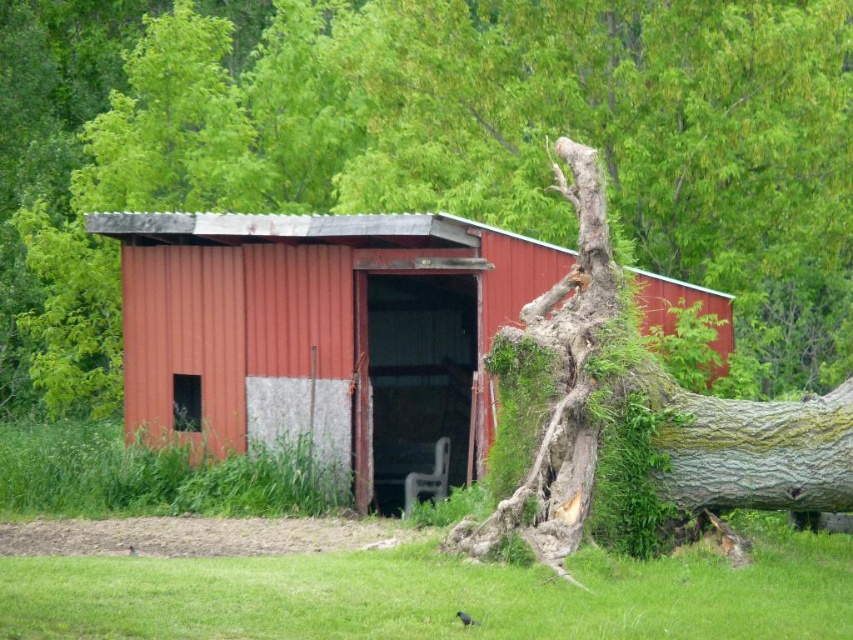
Who is taller, grayish-brown bark tree at center or rustic corrugated metal barn at center?

With more height is grayish-brown bark tree at center.

Is grayish-brown bark tree at center below rustic corrugated metal barn at center?

Incorrect, grayish-brown bark tree at center is not positioned below rustic corrugated metal barn at center.

Does point (289, 72) come behind point (357, 451)?

That is True.

Identify the location of grayish-brown bark tree at center. (465, 154).